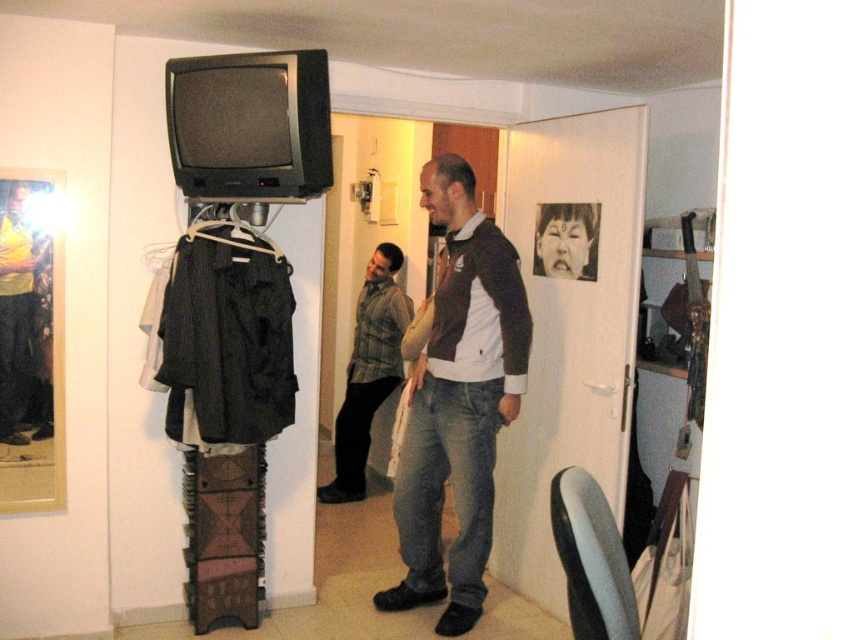
Consider the image. Where is the plaid fabric shirt at center located in the image?

The plaid fabric shirt at center is located at point (x=368, y=371) in the image.

In the scene, there is a plaid fabric shirt at center and a smooth black face at upper center. Which object is positioned higher in the image?

The smooth black face at upper center is positioned higher than the plaid fabric shirt at center.

You are standing in the room and see two points marked in the image. Which of the two points, point [231,212] or point [569,204], is closer to you?

Point [231,212] is closer to the viewer than point [569,204].